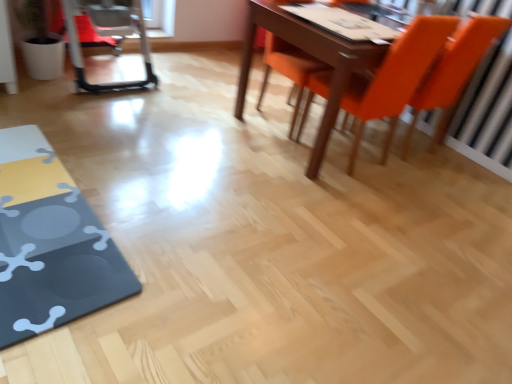
The width and height of the screenshot is (512, 384). I want to click on free space between orange matte chair at upper right, the 1th chair when ordered from left to right, and metallic silver swivel chair at left, so [x=189, y=91].